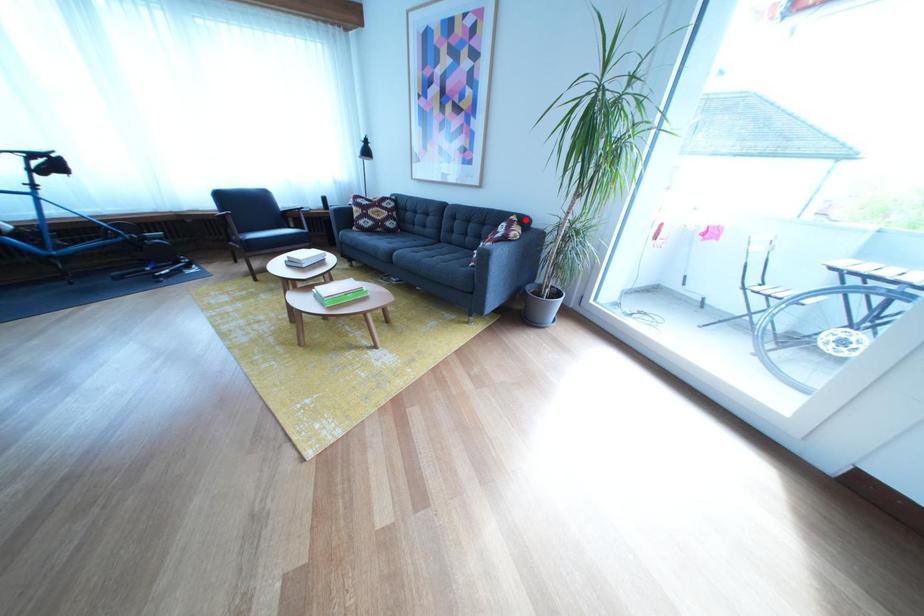
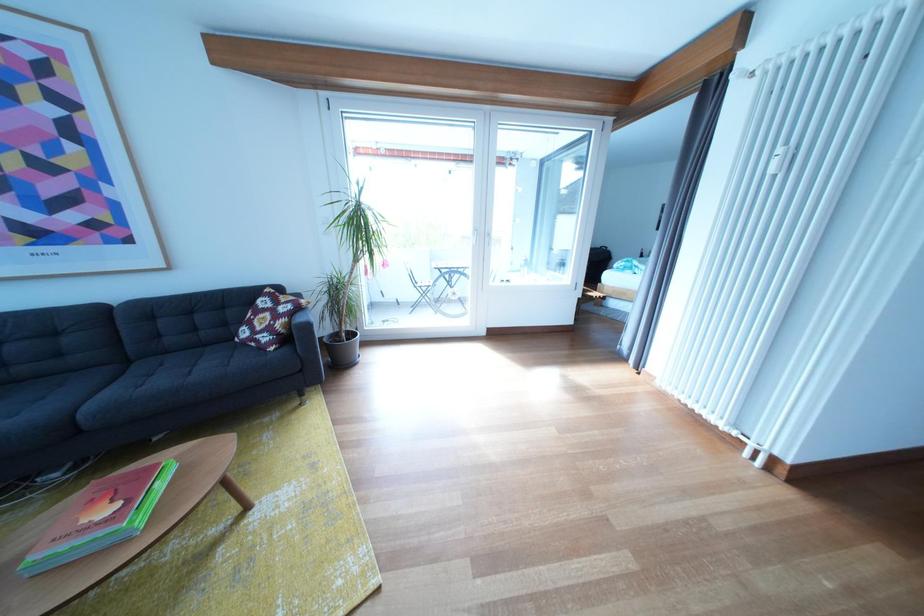
Locate, in the second image, the point that corresponds to the highlighted location in the first image.

(276, 293)